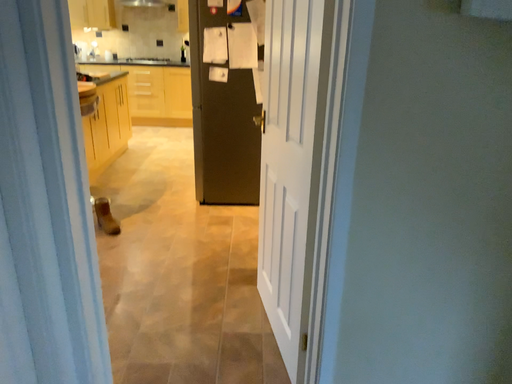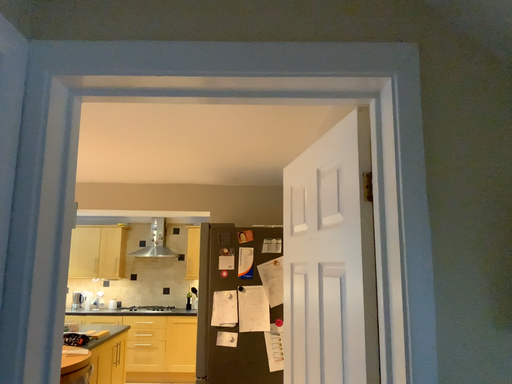
Question: How did the camera likely rotate when shooting the video?

Choices:
 (A) rotated upward
 (B) rotated downward

Answer: (A)